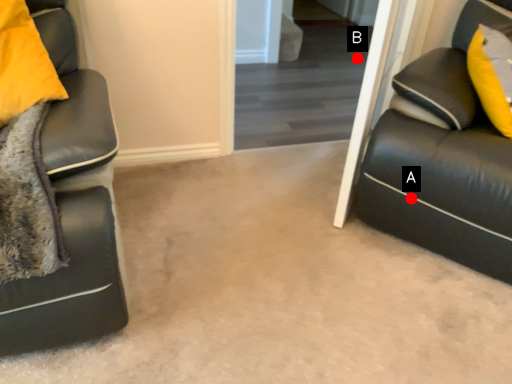
Question: Two points are circled on the image, labeled by A and B beside each circle. Which point is closer to the camera?

Choices:
 (A) A is closer
 (B) B is closer

Answer: (A)